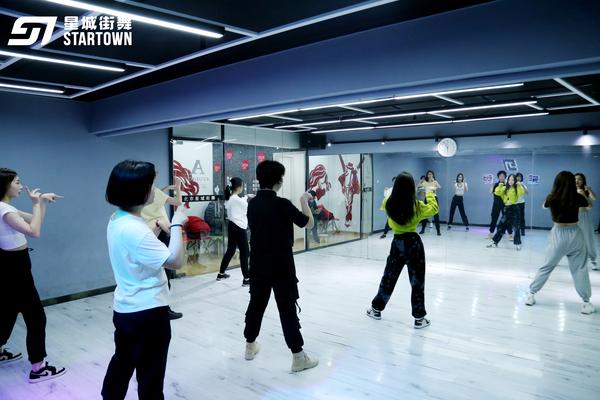
Where is `wall of mirrors`? This screenshot has width=600, height=400. wall of mirrors is located at coordinates (468, 191).